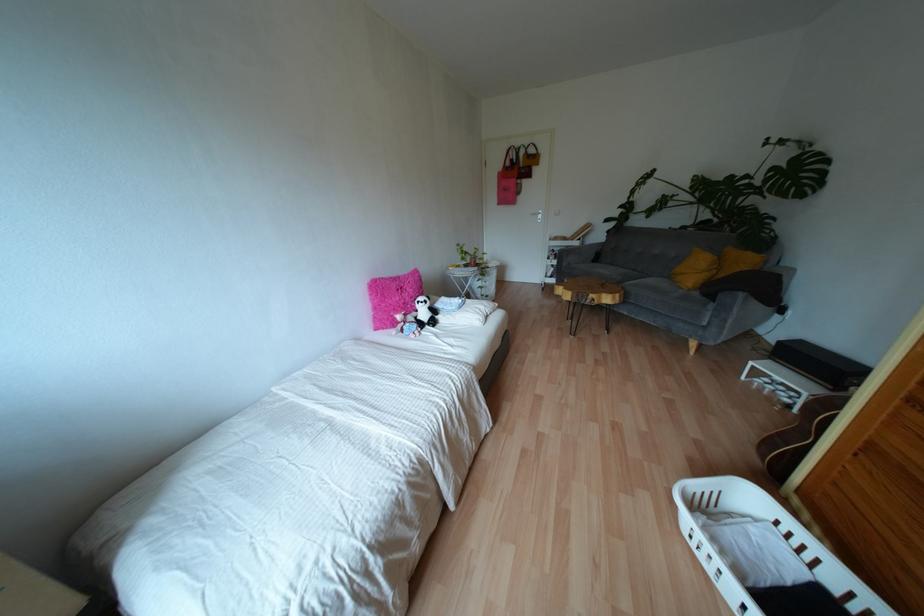
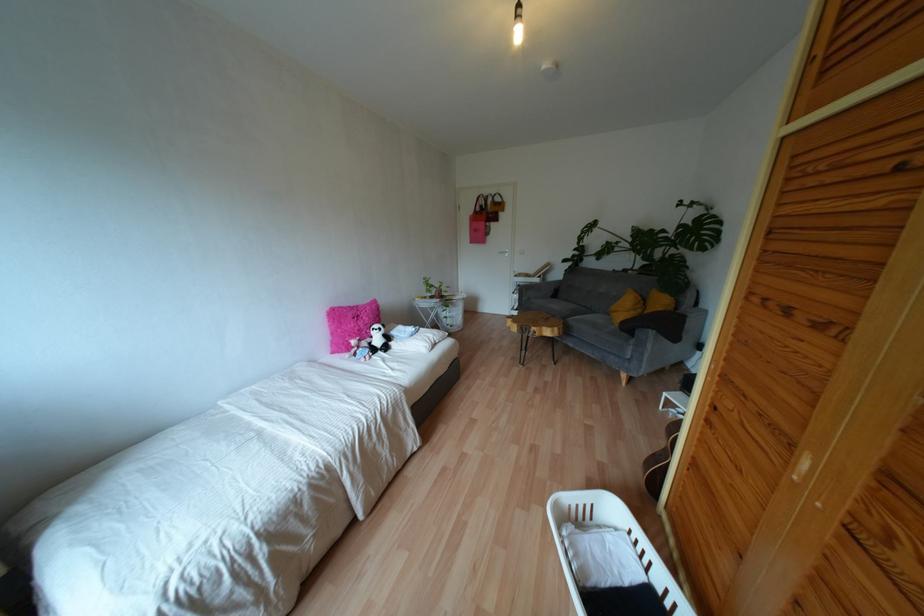
Find the pixel in the second image that matches (506,163) in the first image.

(477, 208)